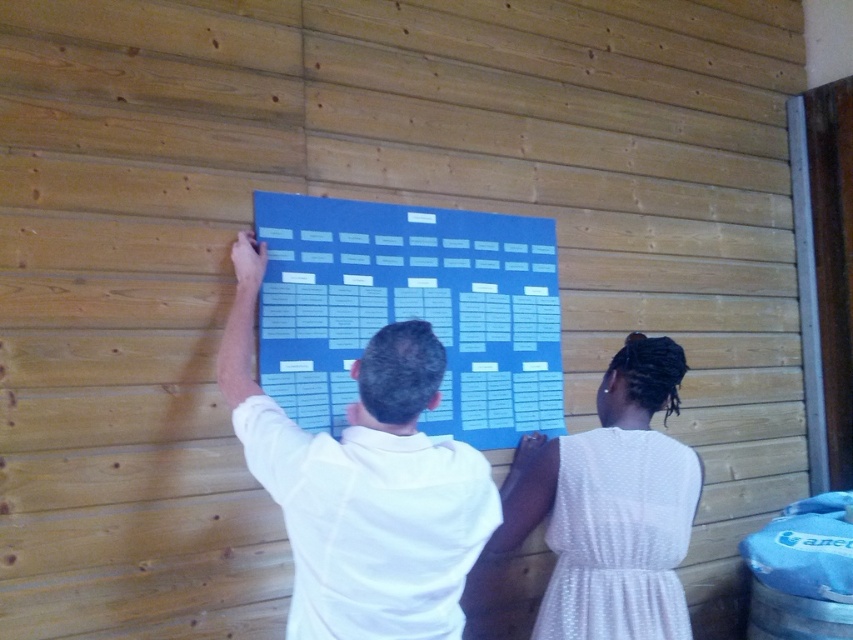
Which of these two, white matte shirt at center or white dotted dress at center, stands shorter?

With less height is white dotted dress at center.

Between point (375, 353) and point (577, 621), which one is positioned behind?

Positioned behind is point (577, 621).

Looking at this image, who is more forward, (430, 634) or (596, 392)?

Positioned in front is point (430, 634).

I want to click on white matte shirt at center, so click(363, 484).

Is blue paperboard at center to the right of white dotted dress at center from the viewer's perspective?

In fact, blue paperboard at center is to the left of white dotted dress at center.

Between blue paperboard at center and white dotted dress at center, which one has more height?

With more height is white dotted dress at center.

Who is more distant from viewer, (x=473, y=333) or (x=555, y=614)?

Positioned behind is point (x=473, y=333).

Identify the location of blue paperboard at center. Image resolution: width=853 pixels, height=640 pixels. (410, 308).

What do you see at coordinates (410, 308) in the screenshot?
I see `blue paperboard at center` at bounding box center [410, 308].

Is blue paperboard at center positioned at the back of white matte shirt at center?

Yes, blue paperboard at center is behind white matte shirt at center.

I want to click on blue paperboard at center, so click(x=410, y=308).

The height and width of the screenshot is (640, 853). Find the location of `blue paperboard at center`. blue paperboard at center is located at coordinates (410, 308).